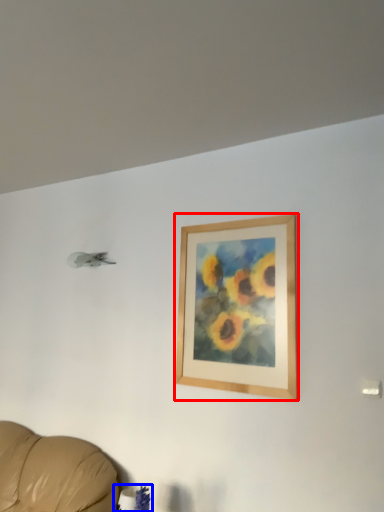
Question: Which object appears farthest to the camera in this image, picture frame (highlighted by a red box) or plant (highlighted by a blue box)?

Choices:
 (A) picture frame
 (B) plant

Answer: (A)